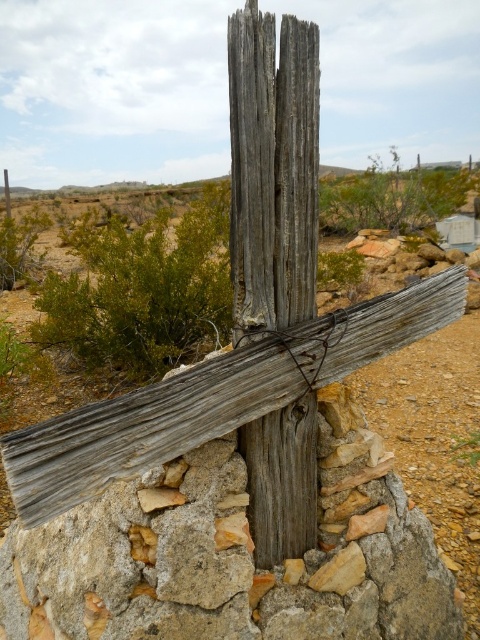
You are a hiker who has reached the weathered wood cross at center and the weathered wood pole at center. You want to take a photo that includes both objects but wants the cross to look bigger than the pole in the frame. Which object should you stand closer to when taking the photo?

To make the weathered wood cross at center appear larger than the weathered wood pole at center in the photo, you should stand closer to the weathered wood cross at center since it is already larger in size than the pole.

You are standing at the base of the weathered wood cross at center. You want to place a small offering at the base of the cross, but you need to know the distance between the cross and the nearest stone in the stone structure. Can you tell me what the distance is?

The distance between the weathered wood cross at center and the nearest stone in the stone structure is 4.68 feet.